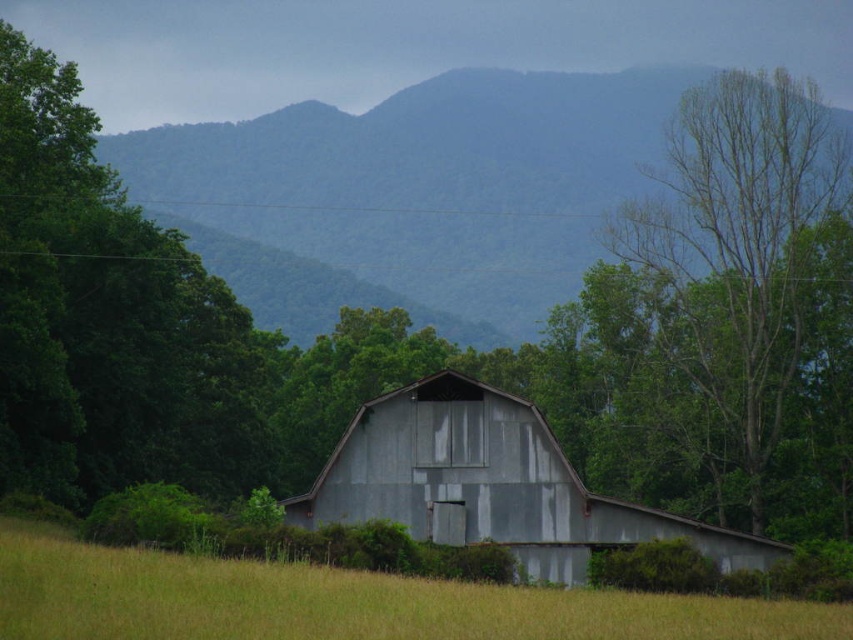
Does yellow grass at center have a larger size compared to rusty metal barn at center?

Actually, yellow grass at center might be smaller than rusty metal barn at center.

Describe the element at coordinates (341, 602) in the screenshot. This screenshot has height=640, width=853. I see `yellow grass at center` at that location.

This screenshot has height=640, width=853. I want to click on yellow grass at center, so click(x=341, y=602).

Between point (381, 113) and point (780, 428), which one is positioned in front?

Point (780, 428)

Between green forested mountain at upper center and bare wood tree at right, which one is positioned higher?

green forested mountain at upper center is higher up.

Is point (195, 150) positioned after point (770, 218)?

Yes.

Identify the location of green forested mountain at upper center. (413, 195).

Between green forested mountain at upper center and yellow grass at center, which one has more height?

green forested mountain at upper center

Who is more forward, (x=440, y=156) or (x=154, y=564)?

Positioned in front is point (x=154, y=564).

Does point (653, 106) come closer to viewer compared to point (796, 616)?

No, (653, 106) is behind (796, 616).

Where is `green forested mountain at upper center`? The width and height of the screenshot is (853, 640). green forested mountain at upper center is located at coordinates (413, 195).